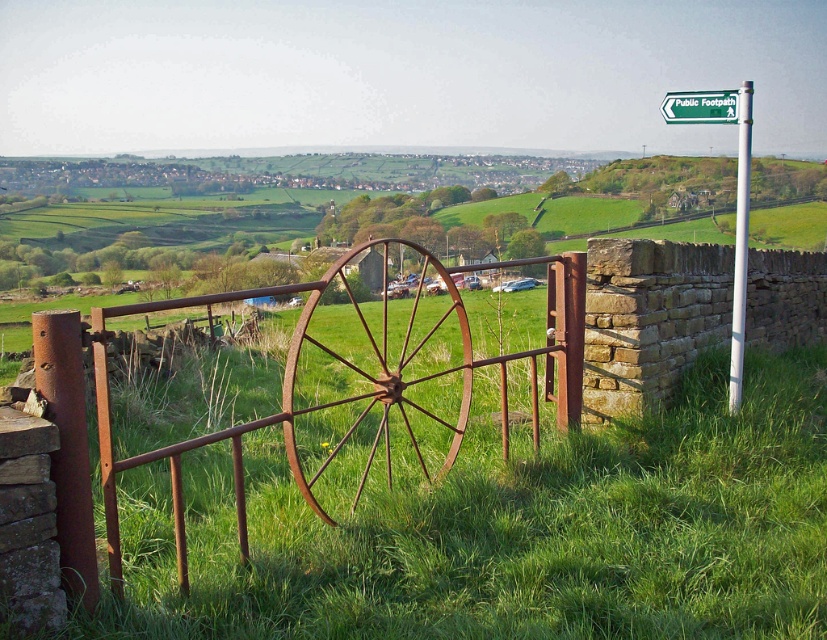
Between point (746, 140) and point (682, 106), which one is positioned behind?

Point (682, 106)

In the scene shown: Who is more distant from viewer, (734, 369) or (696, 116)?

Point (734, 369)

I want to click on green plastic signpost at upper right, so click(735, 195).

Between rusty metal gate at center and white metallic pole at upper right, which one is positioned higher?

Positioned higher is white metallic pole at upper right.

Is rusty metal gate at center bigger than white metallic pole at upper right?

No, rusty metal gate at center is not bigger than white metallic pole at upper right.

Between point (304, 488) and point (732, 412), which one is positioned in front?

Point (304, 488)

What are the coordinates of `rusty metal gate at center` in the screenshot? It's located at (319, 396).

Who is lower down, rusty metal wagon wheel at center or green plastic sign at upper right?

rusty metal wagon wheel at center is below.

Can you confirm if rusty metal wagon wheel at center is thinner than green plastic sign at upper right?

No.

Between point (343, 326) and point (679, 100), which one is positioned behind?

Positioned behind is point (343, 326).

Find the location of a particular element. This screenshot has width=827, height=640. rusty metal wagon wheel at center is located at coordinates 375,378.